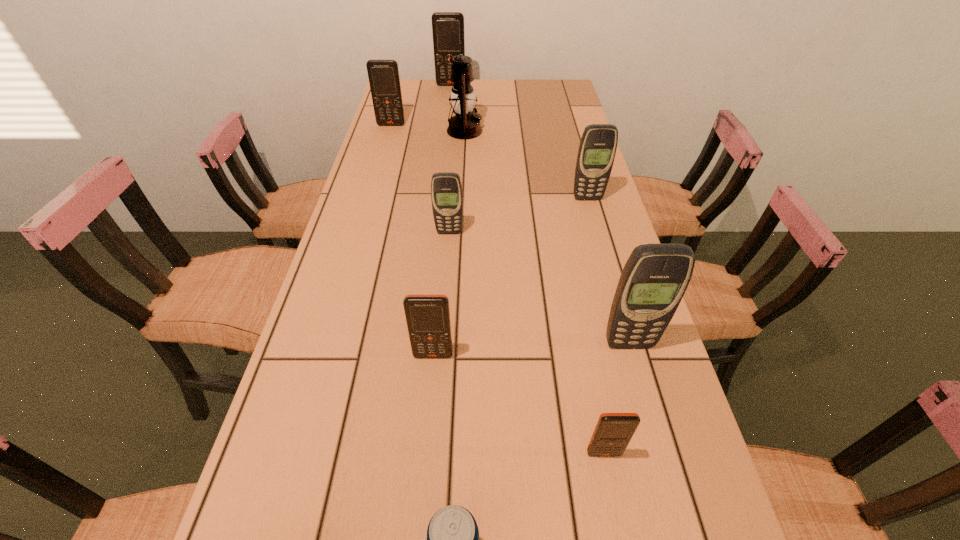
The height and width of the screenshot is (540, 960). I want to click on gray cellular telephone that is the third closest one to the nearest object, so click(x=598, y=145).

Select which gray cellular telephone is the second closest to the farthest object. Please provide its 2D coordinates. Your answer should be formatted as a tuple, i.e. [(x, y)], where the tuple contains the x and y coordinates of a point satisfying the conditions above.

[(446, 189)]